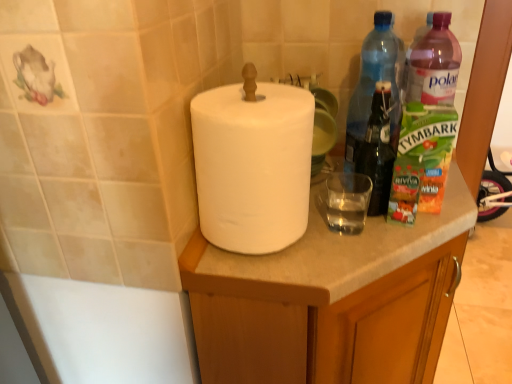
Question: Does transparent plastic bottle at upper right, the second bottle in the right-to-left sequence, turn towards white matte cabinet at center?

Choices:
 (A) yes
 (B) no

Answer: (B)

Question: From a real-world perspective, is transparent plastic bottle at upper right, the second bottle in the right-to-left sequence, below white matte cabinet at center?

Choices:
 (A) yes
 (B) no

Answer: (B)

Question: Is transparent plastic bottle at upper right, the second bottle in the right-to-left sequence, at the left side of white matte cabinet at center?

Choices:
 (A) no
 (B) yes

Answer: (A)

Question: Considering the relative sizes of transparent plastic bottle at upper right, the second bottle in the right-to-left sequence, and white matte cabinet at center in the image provided, is transparent plastic bottle at upper right, the second bottle in the right-to-left sequence, bigger than white matte cabinet at center?

Choices:
 (A) no
 (B) yes

Answer: (A)

Question: From the image's perspective, does transparent plastic bottle at upper right, arranged as the 1th bottle when viewed from the left, appear higher than white matte cabinet at center?

Choices:
 (A) no
 (B) yes

Answer: (B)

Question: Can you confirm if transparent plastic bottle at upper right, arranged as the 1th bottle when viewed from the left, is taller than white matte cabinet at center?

Choices:
 (A) yes
 (B) no

Answer: (B)

Question: Is transparent glass at center touching white matte cabinet at center?

Choices:
 (A) yes
 (B) no

Answer: (B)

Question: From a real-world perspective, is transparent glass at center on top of white matte cabinet at center?

Choices:
 (A) yes
 (B) no

Answer: (A)

Question: Considering the relative positions of transparent glass at center and white matte cabinet at center in the image provided, is transparent glass at center to the right of white matte cabinet at center from the viewer's perspective?

Choices:
 (A) yes
 (B) no

Answer: (B)

Question: Is transparent glass at center closer to camera compared to white matte cabinet at center?

Choices:
 (A) no
 (B) yes

Answer: (A)

Question: From the image's perspective, would you say transparent glass at center is shown under white matte cabinet at center?

Choices:
 (A) no
 (B) yes

Answer: (A)

Question: From the image's perspective, is transparent glass at center on white matte cabinet at center?

Choices:
 (A) yes
 (B) no

Answer: (A)

Question: From the image's perspective, is white matte cabinet at center located above transparent plastic bottle at upper right, the second bottle in the right-to-left sequence?

Choices:
 (A) no
 (B) yes

Answer: (A)